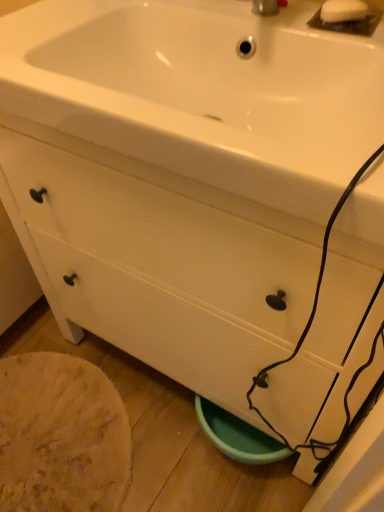
The image size is (384, 512). Describe the element at coordinates (343, 11) in the screenshot. I see `white matte soap at upper right` at that location.

Locate an element on the screen. This screenshot has height=512, width=384. white matte drawer at lower center is located at coordinates (160, 326).

Is white matte drawer at lower center outside of white matte soap at upper right?

Indeed, white matte drawer at lower center is completely outside white matte soap at upper right.

From the image's perspective, is white matte drawer at lower center positioned above or below white matte soap at upper right?

white matte drawer at lower center is below white matte soap at upper right.

Considering the relative positions of white matte drawer at lower center and white matte soap at upper right in the image provided, is white matte drawer at lower center to the right of white matte soap at upper right from the viewer's perspective?

No.

At what (x,y) coordinates should I click in order to perform the action: click on drawer directly beneath the white matte soap at upper right (from a real-world perspective). Please return your answer as a coordinate pair (x, y). Looking at the image, I should click on (160, 326).

Based on the photo, considering the sizes of objects white glossy sink at upper center and white matte soap at upper right in the image provided, who is thinner, white glossy sink at upper center or white matte soap at upper right?

white matte soap at upper right is thinner.

Considering the positions of objects white glossy sink at upper center and white matte soap at upper right in the image provided, who is more to the left, white glossy sink at upper center or white matte soap at upper right?

From the viewer's perspective, white glossy sink at upper center appears more on the left side.

Between point (311, 88) and point (339, 7), which one is positioned in front?

Point (339, 7)

Is white glossy sink at upper center facing towards white matte soap at upper right?

No, white glossy sink at upper center is not oriented towards white matte soap at upper right.

In terms of width, does white matte soap at upper right look wider or thinner when compared to white glossy sink at upper center?

white matte soap at upper right is thinner than white glossy sink at upper center.

Is white matte soap at upper right looking in the opposite direction of white glossy sink at upper center?

No.

Looking at the image, does white matte soap at upper right seem bigger or smaller compared to white glossy sink at upper center?

white matte soap at upper right is smaller than white glossy sink at upper center.

Is the position of white matte soap at upper right less distant than that of white glossy sink at upper center?

No.

Does white glossy sink at upper center turn towards white matte drawer at lower center?

No, white glossy sink at upper center is not facing towards white matte drawer at lower center.

Does white glossy sink at upper center have a lesser height compared to white matte drawer at lower center?

Incorrect, the height of white glossy sink at upper center does not fall short of that of white matte drawer at lower center.

Which is in front, white glossy sink at upper center or white matte drawer at lower center?

white glossy sink at upper center is in front.

From the image's perspective, between white glossy sink at upper center and white matte drawer at lower center, who is located below?

white matte drawer at lower center appears lower in the image.

From the image's perspective, which one is positioned higher, white matte drawer at lower center or white glossy sink at upper center?

From the image's view, white glossy sink at upper center is above.

Relative to white glossy sink at upper center, is white matte drawer at lower center in front or behind?

Clearly, white matte drawer at lower center is behind white glossy sink at upper center.

How different are the orientations of white matte drawer at lower center and white glossy sink at upper center in degrees?

The angular difference between white matte drawer at lower center and white glossy sink at upper center is 91.5 degrees.

Considering the sizes of objects white matte drawer at lower center and white glossy sink at upper center in the image provided, who is thinner, white matte drawer at lower center or white glossy sink at upper center?

white glossy sink at upper center.

From the image's perspective, is white matte soap at upper right located above or below white matte drawer at lower center?

white matte soap at upper right is above white matte drawer at lower center.

In terms of width, does white matte soap at upper right look wider or thinner when compared to white matte drawer at lower center?

In the image, white matte soap at upper right appears to be more narrow than white matte drawer at lower center.

This screenshot has width=384, height=512. I want to click on soap above the white matte drawer at lower center (from the image's perspective), so click(343, 11).

This screenshot has height=512, width=384. Find the location of `drawer behind the white matte soap at upper right`. drawer behind the white matte soap at upper right is located at coordinates (160, 326).

I want to click on sink in front of the white matte soap at upper right, so click(x=203, y=93).

Looking at this image, when comparing their distances from white glossy sink at upper center, does white matte soap at upper right or white matte drawer at lower center seem closer?

Among the two, white matte soap at upper right is located nearer to white glossy sink at upper center.

Which object lies nearer to the anchor point white matte drawer at lower center, white matte soap at upper right or white glossy sink at upper center?

The object closer to white matte drawer at lower center is white glossy sink at upper center.

When comparing their distances from white glossy sink at upper center, does white matte drawer at lower center or white matte soap at upper right seem closer?

white matte soap at upper right lies closer to white glossy sink at upper center than the other object.

Looking at the image, which one is located closer to white matte soap at upper right, white glossy sink at upper center or white matte drawer at lower center?

white glossy sink at upper center lies closer to white matte soap at upper right than the other object.

Estimate the real-world distances between objects in this image. Which object is closer to white matte soap at upper right, white matte drawer at lower center or white glossy sink at upper center?

The object closer to white matte soap at upper right is white glossy sink at upper center.

Considering their positions, is white glossy sink at upper center positioned further to white matte drawer at lower center than white matte soap at upper right?

white matte soap at upper right is positioned further to the anchor white matte drawer at lower center.

What are the coordinates of `sink between white matte soap at upper right and white matte drawer at lower center vertically` in the screenshot? It's located at (203, 93).